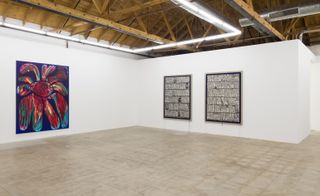
Image resolution: width=320 pixels, height=196 pixels. In order to click on flower on the left painting in this screenshot , I will do `click(34, 93)`.